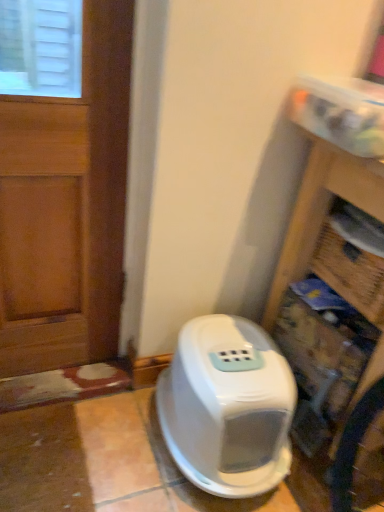
Question: From the image's perspective, is wooden door at left located above or below white plastic litter box at lower center?

Choices:
 (A) above
 (B) below

Answer: (A)

Question: Looking at their shapes, would you say wooden door at left is wider or thinner than white plastic litter box at lower center?

Choices:
 (A) thin
 (B) wide

Answer: (A)

Question: Which object is the farthest from the wooden bookshelf at right?

Choices:
 (A) wooden door at left
 (B) white plastic litter box at lower center

Answer: (A)

Question: Estimate the real-world distances between objects in this image. Which object is closer to the white plastic litter box at lower center?

Choices:
 (A) wooden door at left
 (B) wooden bookshelf at right

Answer: (B)